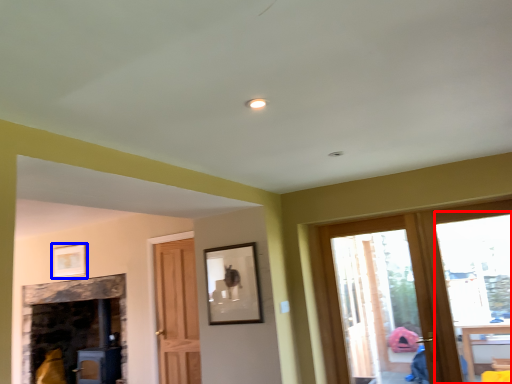
Question: Which object appears farthest to the camera in this image, window (highlighted by a red box) or picture frame (highlighted by a blue box)?

Choices:
 (A) window
 (B) picture frame

Answer: (B)